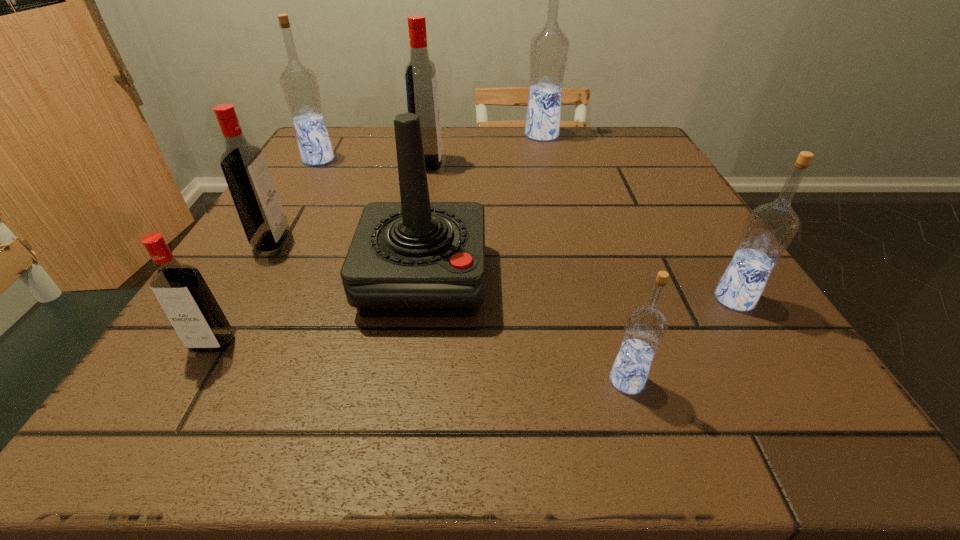
Locate an element on the screen. The image size is (960, 540). free space at the far right corner is located at coordinates point(615,164).

I want to click on free point at the near right corner, so click(707, 405).

Where is `unoccupied position between the farthest red vodka and the sixth farthest vodka`? The image size is (960, 540). unoccupied position between the farthest red vodka and the sixth farthest vodka is located at coordinates (321, 253).

Identify the location of free space between the tallest vodka and the second smallest blue vodka. This screenshot has height=540, width=960. (638, 217).

In order to click on unoccupied position between the second nearest object and the joystick in this screenshot , I will do `click(318, 311)`.

Locate an element on the screen. object that is the sixth closest to the tallest vodka is located at coordinates (645, 327).

Point out which object is positioned as the fifth nearest to the smallest red vodka. Please provide its 2D coordinates. Your answer should be formatted as a tuple, i.e. [(x, y)], where the tuple contains the x and y coordinates of a point satisfying the conditions above.

[(420, 74)]

Identify which vodka is the nearest to the red joystick. Please provide its 2D coordinates. Your answer should be formatted as a tuple, i.e. [(x, y)], where the tuple contains the x and y coordinates of a point satisfying the conditions above.

[(182, 292)]

Locate an element on the screen. vodka that stands as the sixth closest to the leftmost blue vodka is located at coordinates (769, 229).

Point out which blue vodka is positioned as the second nearest to the leftmost blue vodka. Please provide its 2D coordinates. Your answer should be formatted as a tuple, i.e. [(x, y)], where the tuple contains the x and y coordinates of a point satisfying the conditions above.

[(645, 327)]